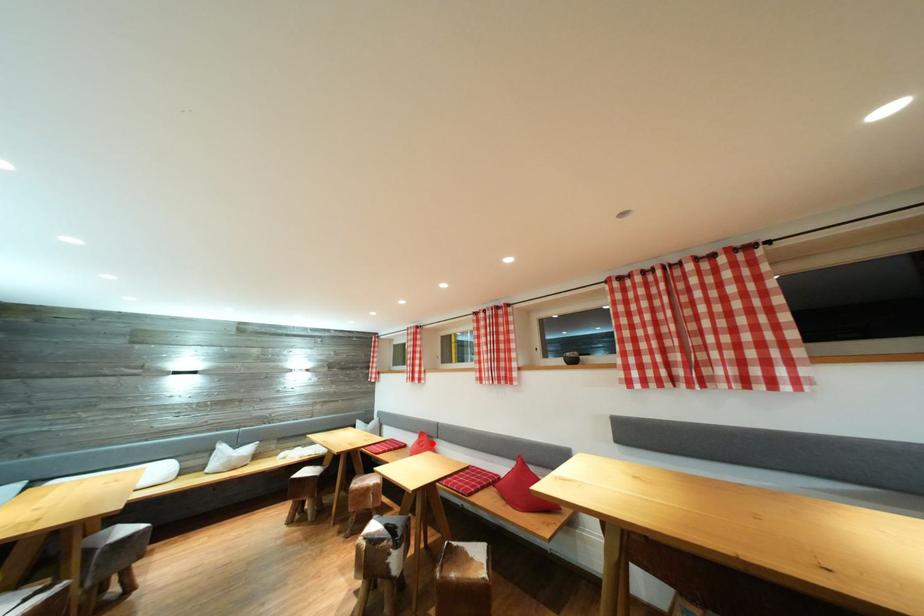
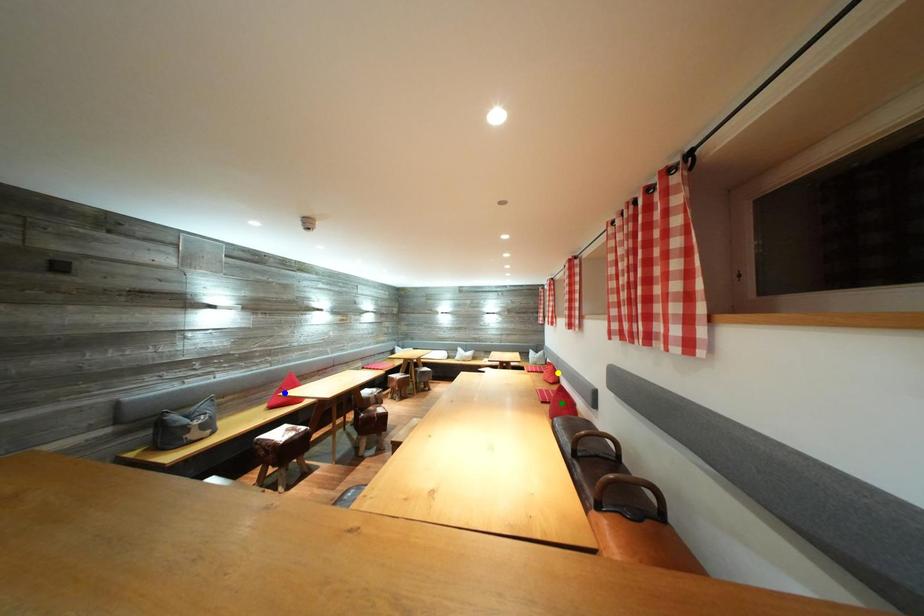
Question: I am providing you with two images of the same scene from different viewpoints. A red point is marked on the first image. You are given multiple points on the second image. Which spot in image 2 lines up with the point in image 1?

Choices:
 (A) yellow point
 (B) blue point
 (C) green point

Answer: (A)